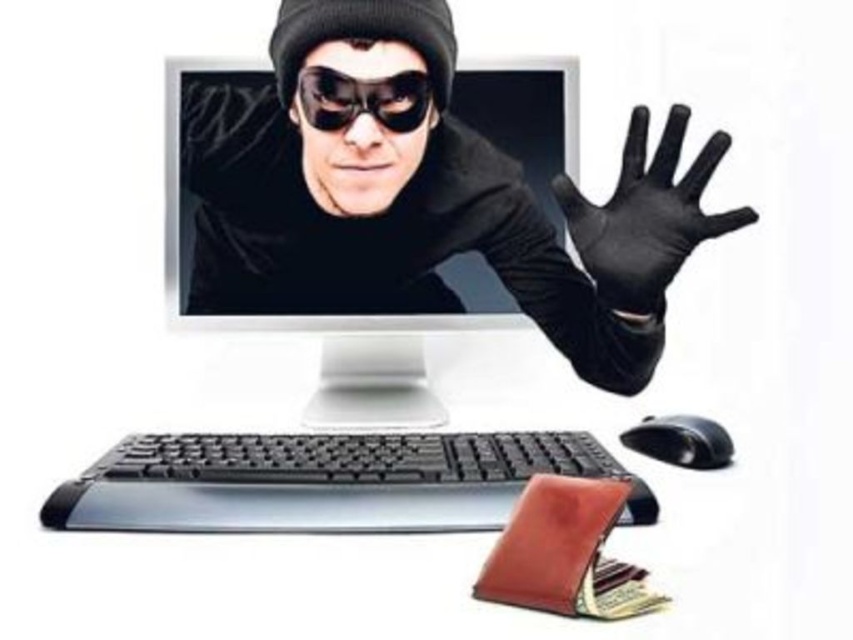
Is black plastic keyboard at lower center below black leather glove at right?

Indeed, black plastic keyboard at lower center is positioned under black leather glove at right.

Does black plastic keyboard at lower center have a greater height compared to black leather glove at right?

Incorrect, black plastic keyboard at lower center's height is not larger of black leather glove at right's.

Is point (306, 518) in front of point (585, 268)?

Yes, it is in front of point (585, 268).

At what (x,y) coordinates should I click in order to perform the action: click on black plastic keyboard at lower center. Please return your answer as a coordinate pair (x, y). This screenshot has height=640, width=853. Looking at the image, I should click on (326, 481).

Is white glossy computer monitor at center smaller than black plastic mouse at lower right?

No, white glossy computer monitor at center is not smaller than black plastic mouse at lower right.

Who is positioned more to the right, white glossy computer monitor at center or black plastic mouse at lower right?

Positioned to the right is black plastic mouse at lower right.

Who is more distant from viewer, (492, 120) or (646, 445)?

The point (492, 120) is more distant.

Image resolution: width=853 pixels, height=640 pixels. Find the location of `white glossy computer monitor at center`. white glossy computer monitor at center is located at coordinates (300, 308).

Can you confirm if black leather glove at right is bigger than black plastic mouse at lower right?

Yes, black leather glove at right is bigger than black plastic mouse at lower right.

Does point (641, 147) come in front of point (706, 444)?

No, it is behind (706, 444).

The width and height of the screenshot is (853, 640). I want to click on black leather glove at right, so click(646, 216).

What are the coordinates of `black leather glove at right` in the screenshot? It's located at (646, 216).